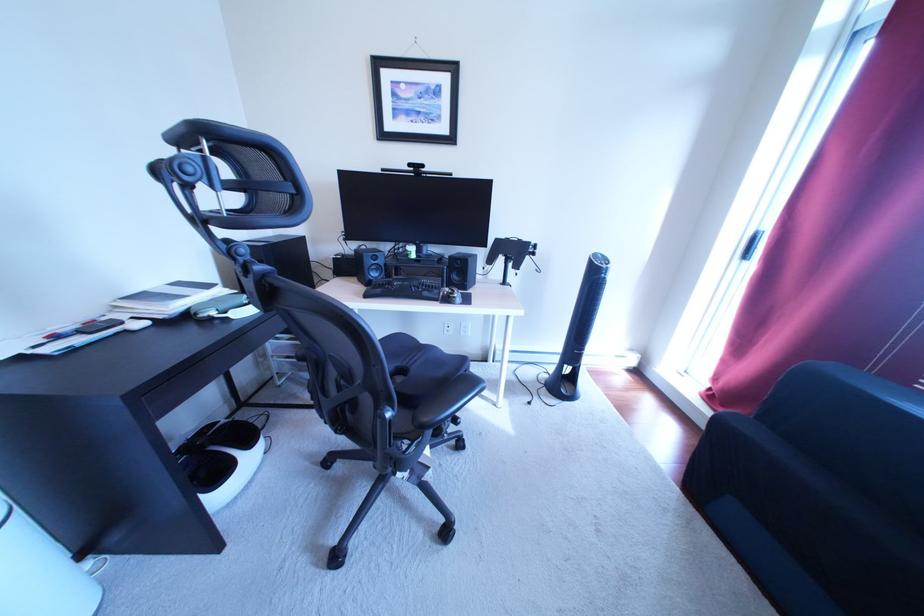
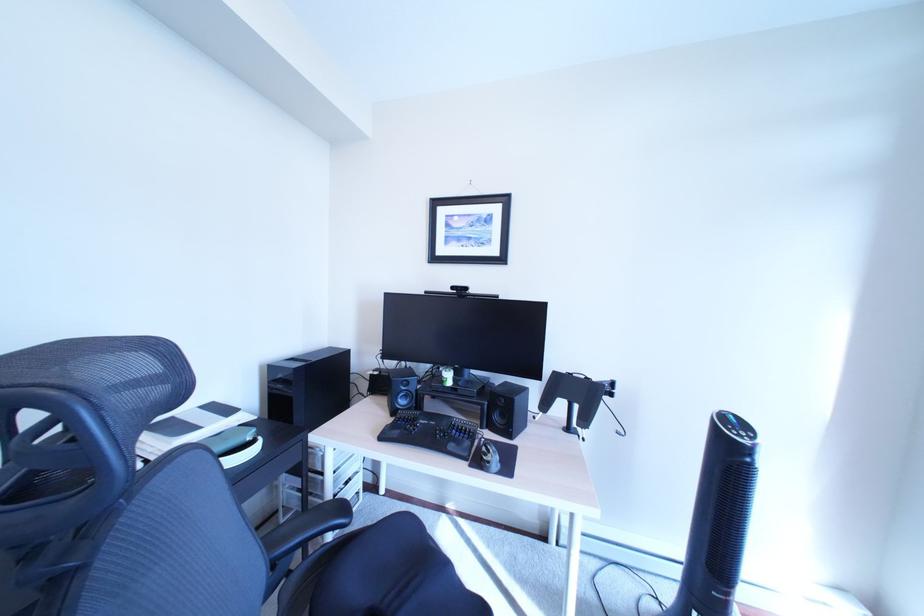
How did the camera likely rotate?

The rotation direction of the camera is left-up.